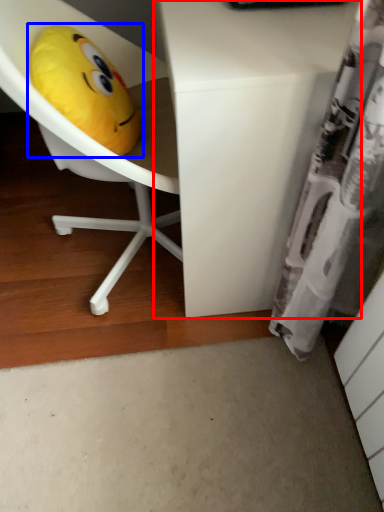
Question: Which of the following is the closest to the observer, desk (highlighted by a red box) or toy (highlighted by a blue box)?

Choices:
 (A) desk
 (B) toy

Answer: (A)